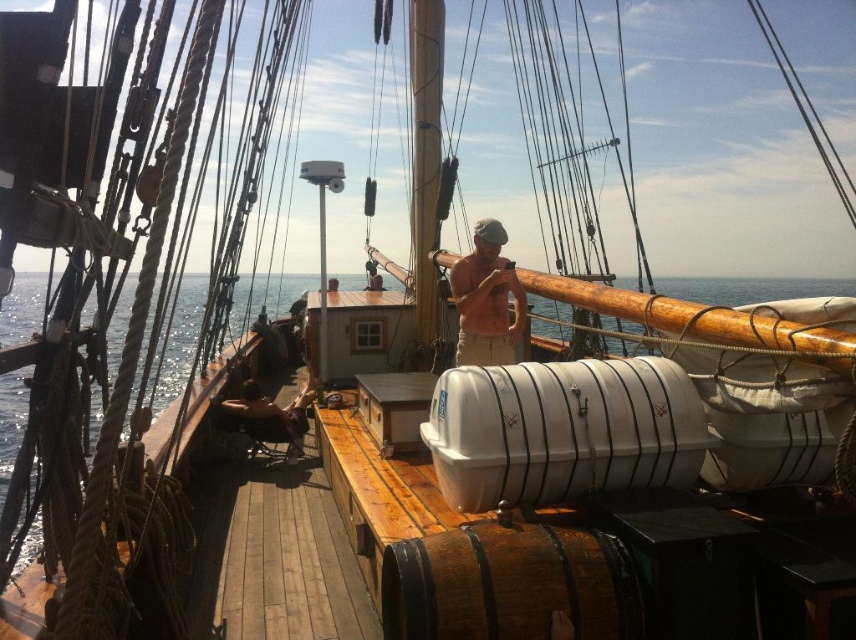
What are the coordinates of the tan cotton shirt at center?

The tan cotton shirt at center is located at point (486, 300).

Looking at this image, you are a sailor on the ship deck and you want to hang a small hook on the deck so that it is above both the tan cotton shirt at center and the smooth brown hair at lower left. Which object should you place the hook closer to to ensure it is above both?

The tan cotton shirt at center is taller than smooth brown hair at lower left, so placing the hook closer to the tan cotton shirt at center would ensure it is above both.